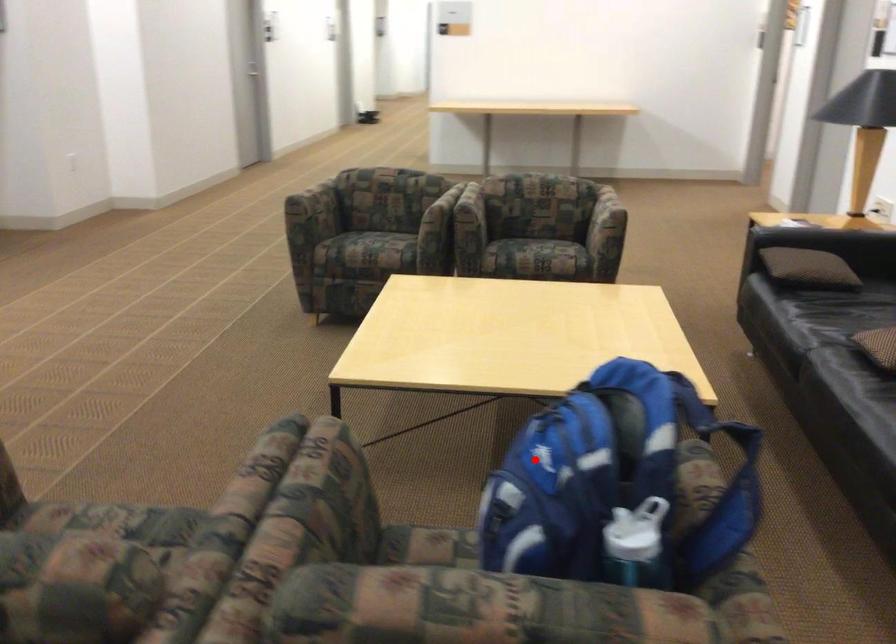
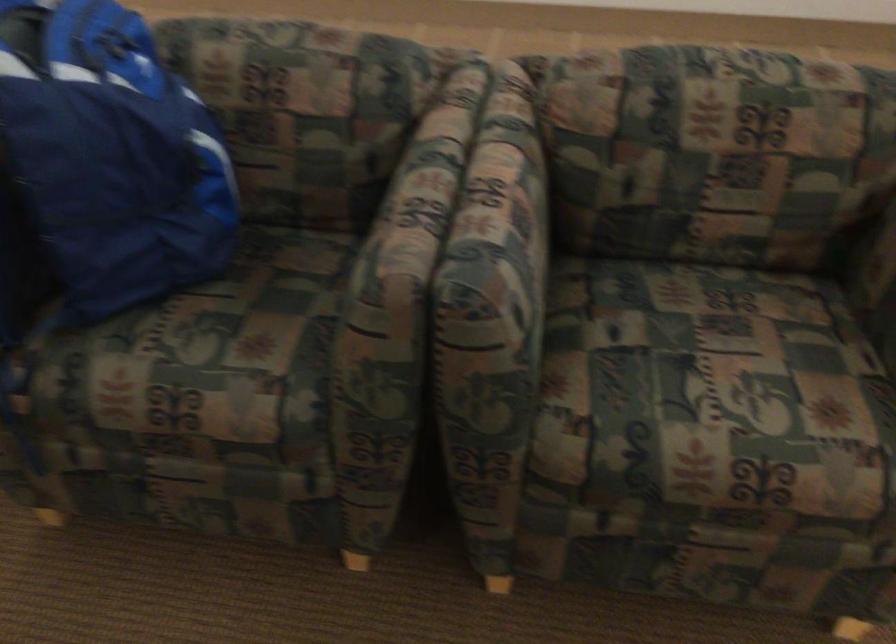
Question: A red point is marked in image1. In image2, is the corresponding 3D point closer to the camera or farther? Reply with the corresponding letter.

Choices:
 (A) The corresponding 3D point is closer.
 (B) The corresponding 3D point is farther.

Answer: (A)